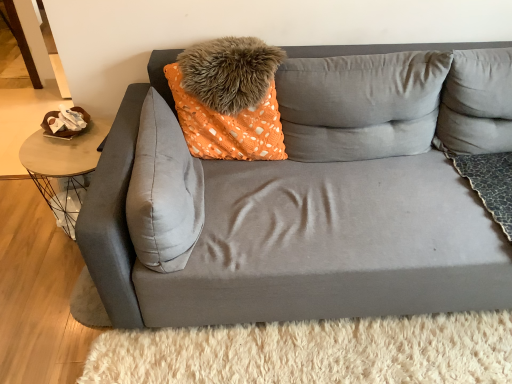
Question: Does point 61,163 appear closer or farther from the camera than point 211,152?

Choices:
 (A) closer
 (B) farther

Answer: (A)

Question: Is metallic wire table at left to the left or to the right of orange dotted fabric pillow at center, which appears as the 4th pillow when viewed from the right, in the image?

Choices:
 (A) right
 (B) left

Answer: (B)

Question: Which is farther from the gray fabric pillow at center, which is the fourth pillow in left-to-right order?

Choices:
 (A) gray fabric pillow at upper right, the fifth pillow in the left-to-right sequence
 (B) orange dotted fabric pillow at center, which appears as the 4th pillow when viewed from the right
 (C) matte gray couch at center
 (D) fuzzy orange pillow at upper center, which is the third pillow from right to left
 (E) suede gray pillow at center, the first pillow positioned from the left

Answer: (C)

Question: Estimate the real-world distances between objects in this image. Which object is farther from the fuzzy orange pillow at upper center, arranged as the third pillow when viewed from the left?

Choices:
 (A) gray fabric pillow at upper right, arranged as the 1th pillow when viewed from the right
 (B) gray fabric pillow at center, marked as the 2th pillow in a right-to-left arrangement
 (C) suede gray pillow at center, placed as the fifth pillow when sorted from right to left
 (D) matte gray couch at center
 (E) metallic wire table at left

Answer: (A)